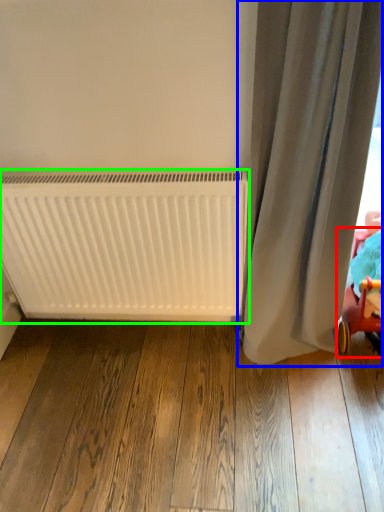
Question: Based on their relative distances, which object is farther from baby carriage (highlighted by a red box)? Choose from curtain (highlighted by a blue box) and radiator (highlighted by a green box).

Choices:
 (A) curtain
 (B) radiator

Answer: (B)